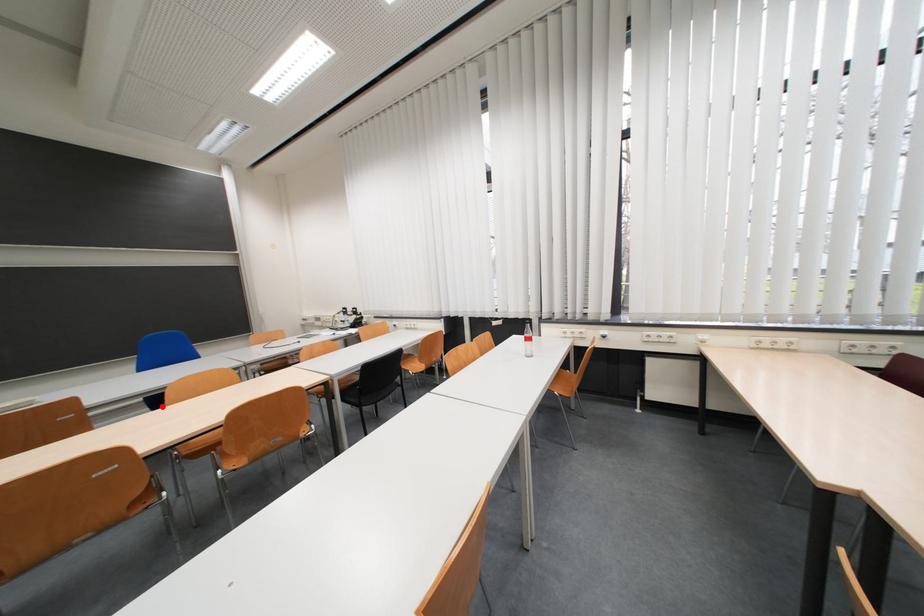
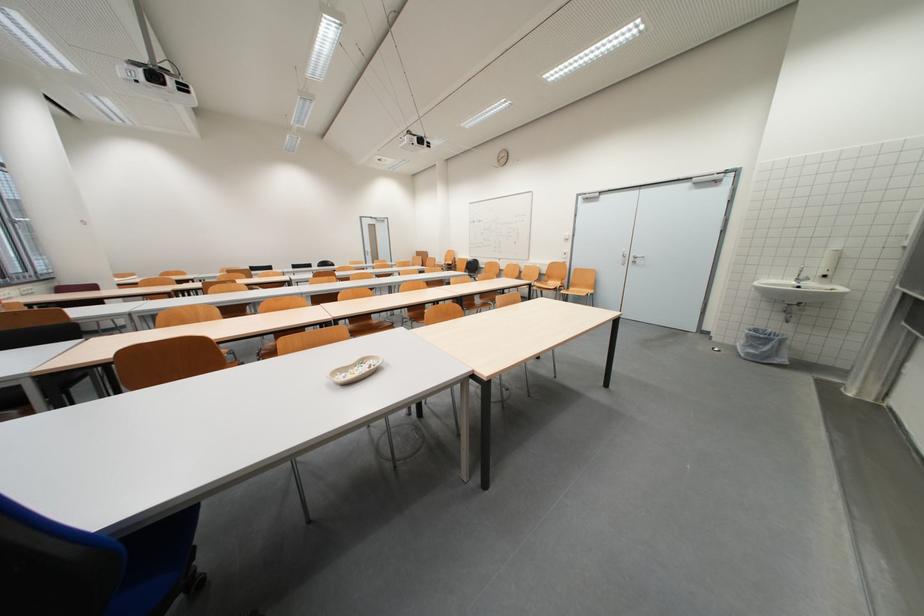
Question: I am providing you with two images of the same scene from different viewpoints. A red point is marked on the first image. At the location where the point appears in image 1, is it still visible in image 2?

Choices:
 (A) Yes
 (B) No

Answer: (B)